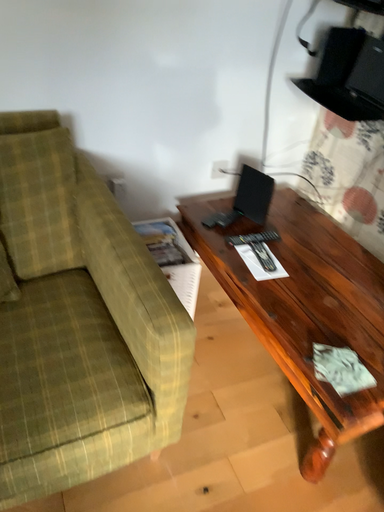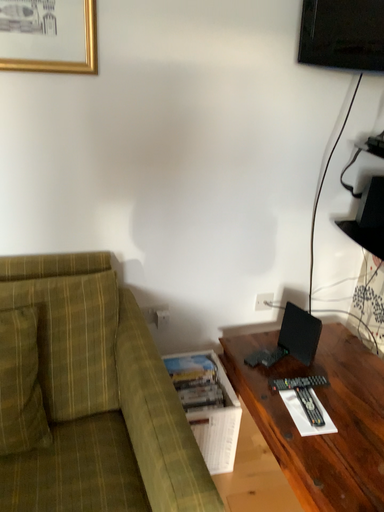
Question: How did the camera likely rotate when shooting the video?

Choices:
 (A) rotated downward
 (B) rotated upward

Answer: (B)